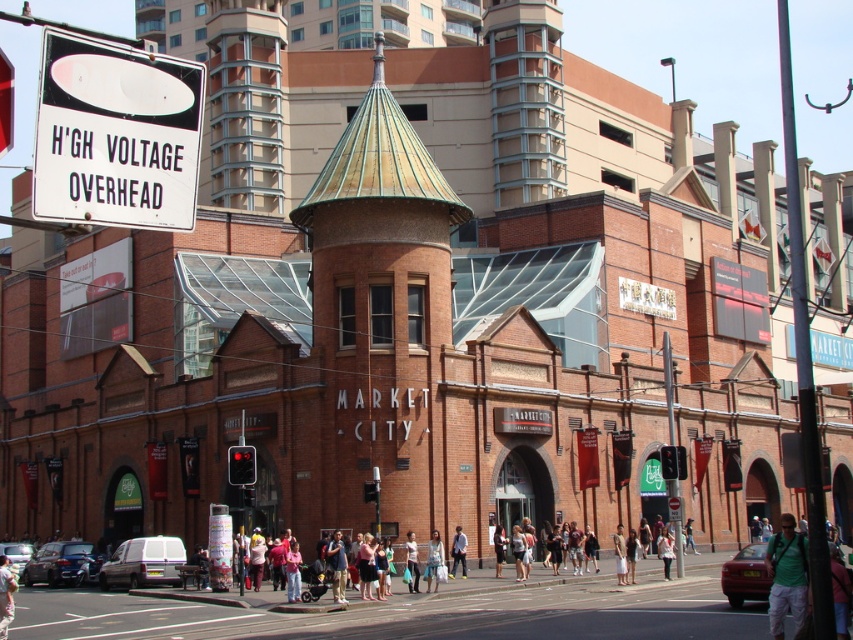
Measure the distance between green fabric backpack at lower right and camera.

green fabric backpack at lower right and camera are 33.61 meters apart.

How distant is green fabric backpack at lower right from light blue jeans at center?

green fabric backpack at lower right is 23.37 meters away from light blue jeans at center.

Does point (776, 544) lie in front of point (453, 566)?

That is True.

You are a GUI agent. You are given a task and a screenshot of the screen. Output one action in this format:
    pyautogui.click(x=<x>, y=<y>)
    Task: Click on the green fabric backpack at lower right
    
    Given the screenshot: What is the action you would take?
    pyautogui.click(x=786, y=576)

Who is shorter, light beige pants at lower left or light blue denim jeans at center?

Standing shorter between the two is light blue denim jeans at center.

Looking at this image, which is more to the left, light beige pants at lower left or light blue denim jeans at center?

Positioned to the left is light beige pants at lower left.

I want to click on light beige pants at lower left, so click(x=4, y=595).

The width and height of the screenshot is (853, 640). Identify the location of light beige pants at lower left. (4, 595).

Is denim jacket at center below light brown leather jacket at center?

Incorrect, denim jacket at center is not positioned below light brown leather jacket at center.

Does denim jacket at center have a lesser width compared to light brown leather jacket at center?

Indeed, denim jacket at center has a lesser width compared to light brown leather jacket at center.

Which is behind, point (424, 573) or point (625, 572)?

The point (424, 573) is more distant.

Locate an element on the screen. The image size is (853, 640). denim jacket at center is located at coordinates (433, 561).